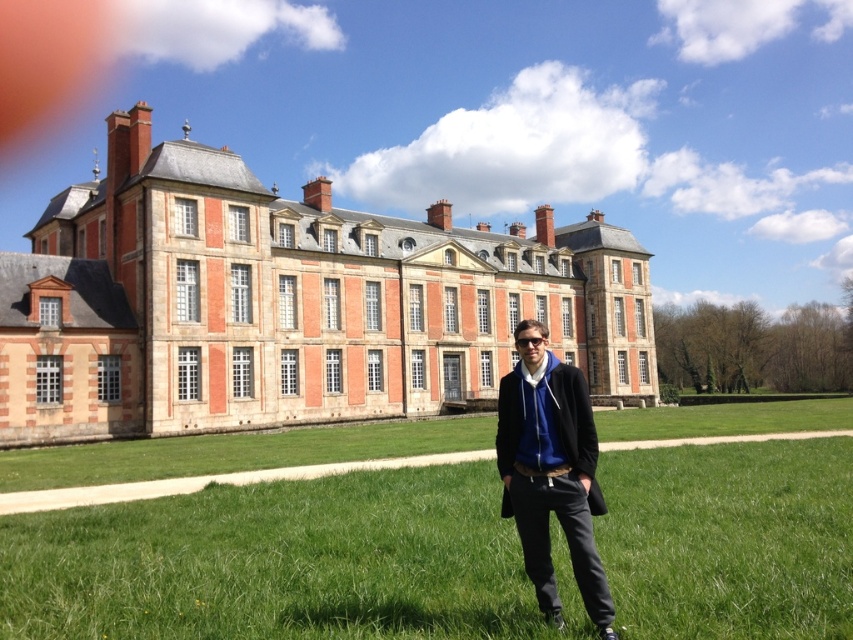
You are standing at the point marked as point [287,301]. Which object is exactly at your current position?

The brick stone palace at center is located at point [287,301], so the object exactly at your current position is the brick stone palace at center.

You are a photographer planning to take a photo of the brick stone palace at center and the green grass at center. Considering their heights, which object will appear larger in the photo?

The brick stone palace at center will appear larger in the photo because it has a greater height compared to the green grass at center.